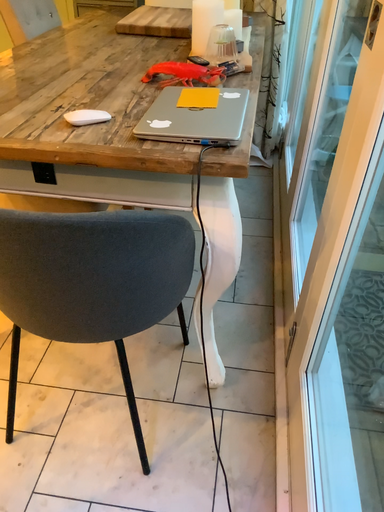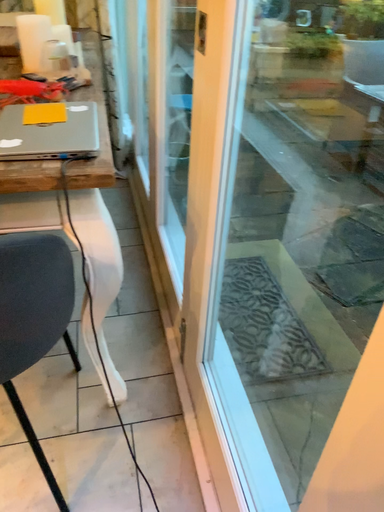
Question: Which way did the camera rotate in the video?

Choices:
 (A) rotated right
 (B) rotated left

Answer: (A)